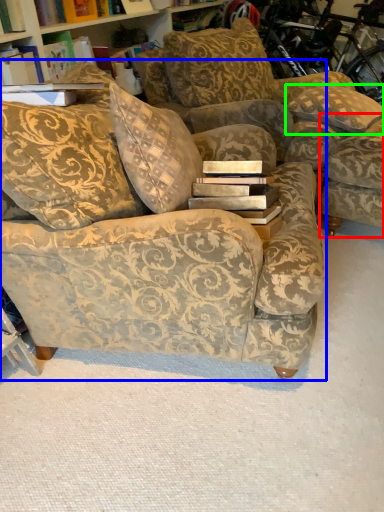
Question: Which object is the farthest from swivel chair (highlighted by a red box)? Choose among these: studio couch (highlighted by a blue box) or pillow (highlighted by a green box).

Choices:
 (A) studio couch
 (B) pillow

Answer: (A)